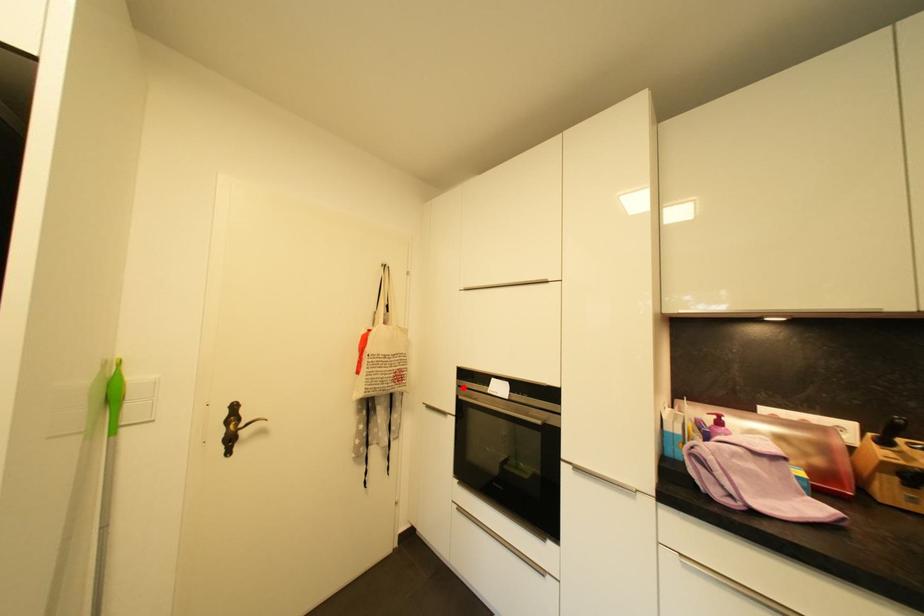
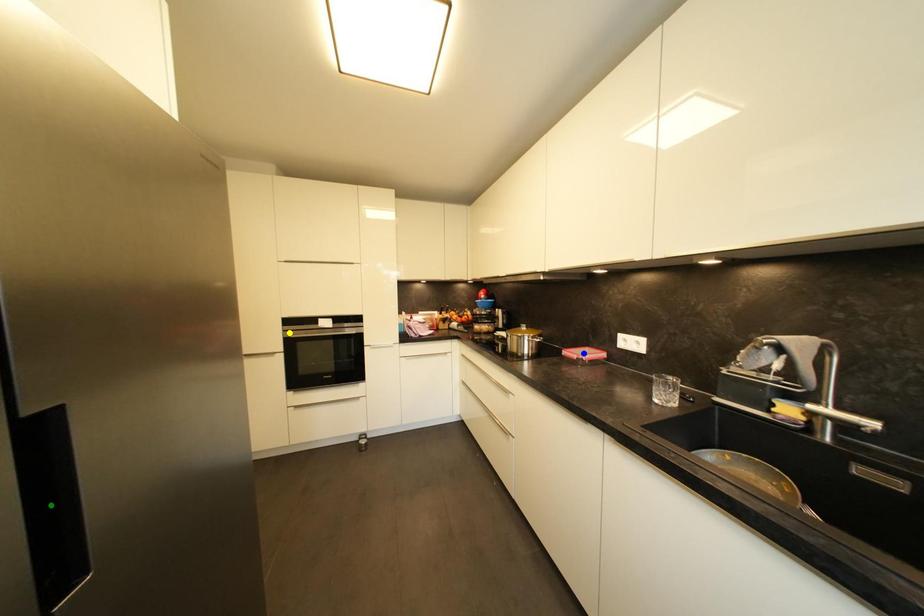
Question: I am providing you with two images of the same scene from different viewpoints. A red point is marked on the first image. You are given multiple points on the second image. Which point in image 2 represents the same 3d spot as the red point in image 1?

Choices:
 (A) blue point
 (B) yellow point
 (C) green point

Answer: (B)